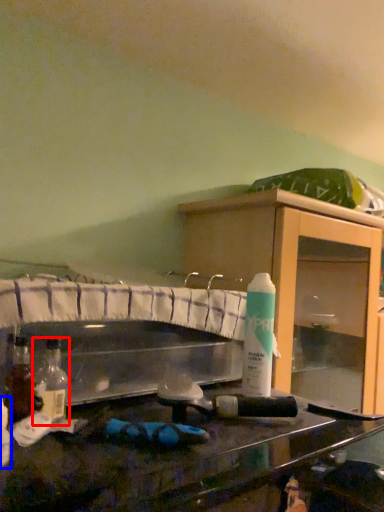
Question: Among these objects, which one is farthest to the camera, bottle (highlighted by a red box) or bottle (highlighted by a blue box)?

Choices:
 (A) bottle
 (B) bottle

Answer: (A)